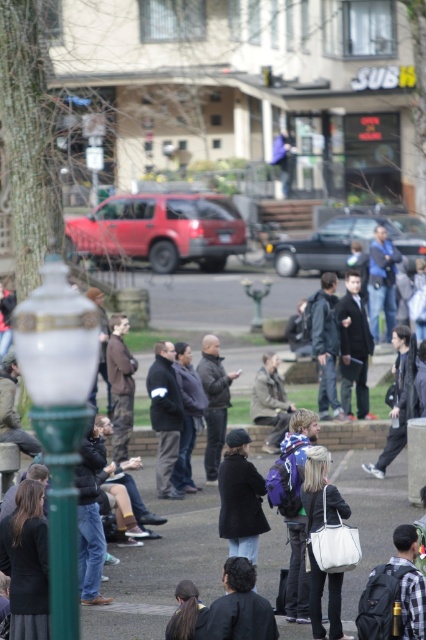
How much distance is there between concrete pavement at center and white leather handbag at center?

They are 2.90 meters apart.

Which is behind, point (135, 561) or point (325, 492)?

The point (135, 561) is more distant.

Locate an element on the screen. concrete pavement at center is located at coordinates (160, 566).

Can you confirm if matte black jacket at center is taller than dark gray jacket at center?

No.

Who is more distant from viewer, (149, 632) or (379, 476)?

Positioned behind is point (379, 476).

Locate an element on the screen. The image size is (426, 640). matte black jacket at center is located at coordinates (161, 566).

Is point (227, 604) more distant than point (412, 397)?

No, (227, 604) is in front of (412, 397).

Is point (256, 598) behind point (402, 378)?

No, (256, 598) is in front of (402, 378).

Where is `dark gray jacket at lower center`? This screenshot has width=426, height=640. dark gray jacket at lower center is located at coordinates (238, 605).